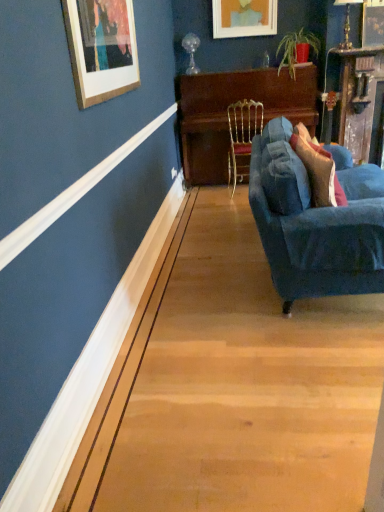
Question: From the image's perspective, is gold metallic chair at center above or below wooden piano at center?

Choices:
 (A) below
 (B) above

Answer: (A)

Question: In the image, is gold metallic chair at center on the left side or the right side of wooden piano at center?

Choices:
 (A) right
 (B) left

Answer: (B)

Question: Which of these objects is positioned closest to the velvet blue couch at right?

Choices:
 (A) matte wooden picture frame at upper center, placed as the 2th picture frame when sorted from right to left
 (B) wooden piano at center
 (C) velvet blue pillow at right
 (D) wooden picture frame at upper right, the second picture frame in the left-to-right sequence
 (E) gold metallic chair at center

Answer: (C)

Question: Which object is positioned closest to the wooden piano at center?

Choices:
 (A) gold metallic chair at center
 (B) matte wooden picture frame at upper center, positioned as the 1th picture frame in left-to-right order
 (C) velvet blue pillow at right
 (D) velvet blue couch at right
 (E) wooden picture frame at upper right, which is the first picture frame in right-to-left order

Answer: (A)